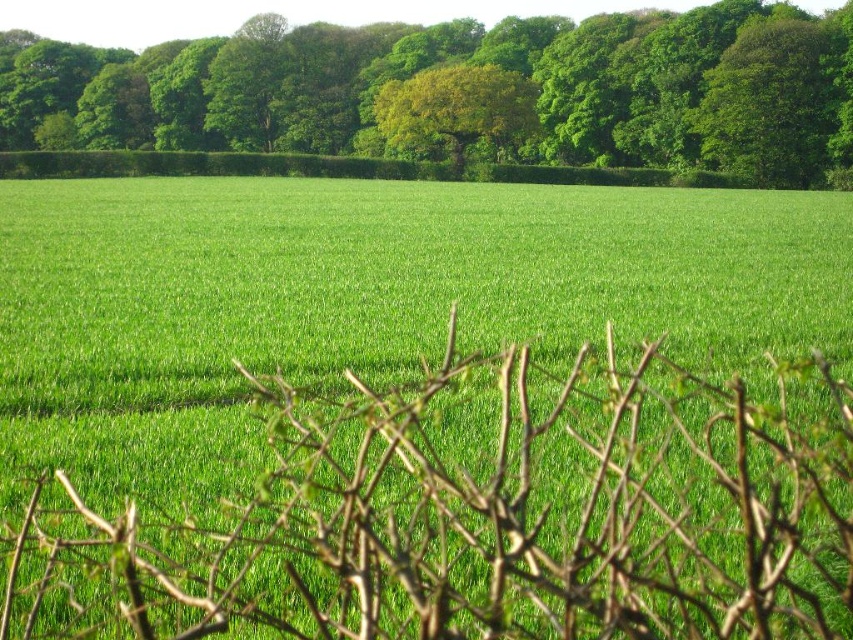
Question: Estimate the real-world distances between objects in this image. Which object is closer to the green grass at center?

Choices:
 (A) green leafy tree at upper center
 (B) green leafy tree at center

Answer: (B)

Question: Is green grass at center behind green leafy tree at center?

Choices:
 (A) no
 (B) yes

Answer: (A)

Question: In this image, where is green grass at center located relative to green leafy tree at center?

Choices:
 (A) right
 (B) left

Answer: (B)

Question: Is green leafy tree at upper center smaller than green leafy tree at center?

Choices:
 (A) yes
 (B) no

Answer: (B)

Question: Which point appears farthest from the camera in this image?

Choices:
 (A) (602, 13)
 (B) (759, 216)

Answer: (A)

Question: Estimate the real-world distances between objects in this image. Which object is farther from the green grass at center?

Choices:
 (A) green leafy tree at upper center
 (B) green leafy tree at center

Answer: (A)